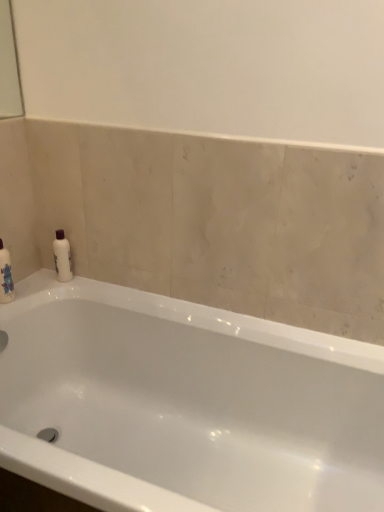
Question: Is white glossy bathtub at center looking in the opposite direction of white glossy bottle at upper left?

Choices:
 (A) yes
 (B) no

Answer: (B)

Question: From a real-world perspective, is white glossy bathtub at center on white glossy bottle at upper left?

Choices:
 (A) yes
 (B) no

Answer: (B)

Question: Is white glossy bathtub at center to the right of white glossy bottle at upper left from the viewer's perspective?

Choices:
 (A) no
 (B) yes

Answer: (B)

Question: Is the position of white glossy bathtub at center less distant than that of white glossy bottle at upper left?

Choices:
 (A) no
 (B) yes

Answer: (B)

Question: Are white glossy bathtub at center and white glossy bottle at upper left far apart?

Choices:
 (A) yes
 (B) no

Answer: (B)

Question: Does white glossy bathtub at center lie behind white glossy bottle at upper left?

Choices:
 (A) yes
 (B) no

Answer: (B)

Question: Is white glossy bottle at upper left in front of white glossy bathtub at center?

Choices:
 (A) yes
 (B) no

Answer: (B)

Question: Is white glossy bottle at upper left looking in the opposite direction of white glossy bathtub at center?

Choices:
 (A) no
 (B) yes

Answer: (A)

Question: Is white glossy bottle at upper left touching white glossy bathtub at center?

Choices:
 (A) yes
 (B) no

Answer: (B)

Question: Considering the relative positions of white glossy bottle at upper left and white glossy bathtub at center in the image provided, is white glossy bottle at upper left behind white glossy bathtub at center?

Choices:
 (A) yes
 (B) no

Answer: (A)

Question: Is white glossy bottle at upper left to the right of white glossy bathtub at center from the viewer's perspective?

Choices:
 (A) yes
 (B) no

Answer: (B)

Question: From a real-world perspective, is white glossy bottle at upper left positioned over white glossy bathtub at center based on gravity?

Choices:
 (A) yes
 (B) no

Answer: (A)

Question: Relative to white glossy bottle at upper left, is white glossy bathtub at center in front or behind?

Choices:
 (A) behind
 (B) front

Answer: (B)